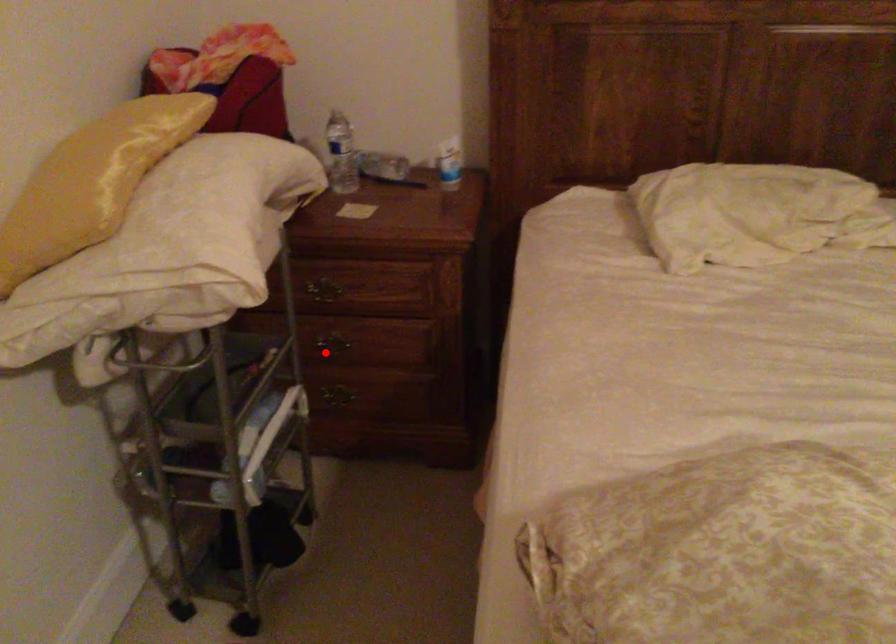
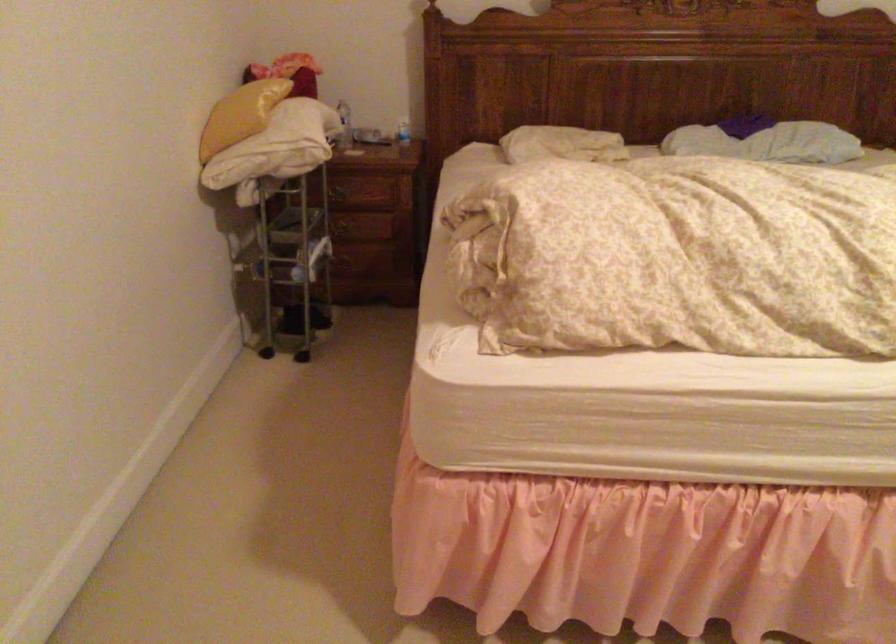
Where in the second image is the point corresponding to the highlighted location from the first image?

(342, 230)